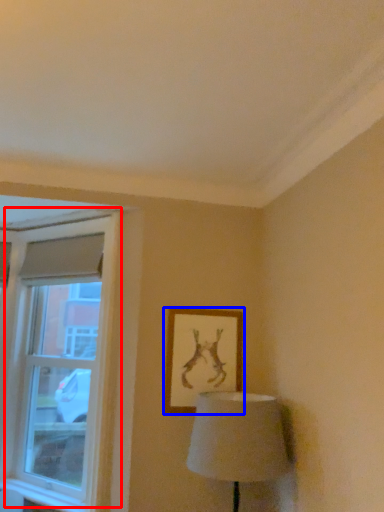
Question: Which object appears farthest to the camera in this image, window (highlighted by a red box) or picture frame (highlighted by a blue box)?

Choices:
 (A) window
 (B) picture frame

Answer: (B)